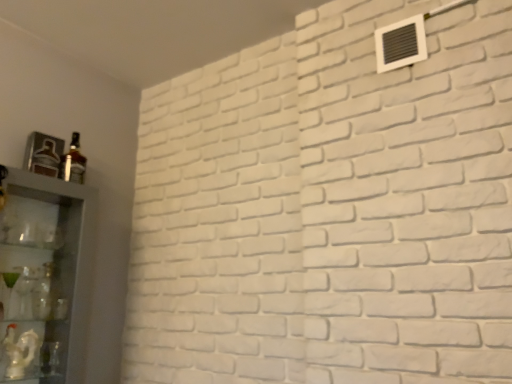
Question: Does matte glass bottle at left have a smaller size compared to white plastic air conditioning unit at upper right?

Choices:
 (A) no
 (B) yes

Answer: (B)

Question: Does matte glass bottle at left have a lesser height compared to white plastic air conditioning unit at upper right?

Choices:
 (A) yes
 (B) no

Answer: (B)

Question: Does matte glass bottle at left appear on the left side of white plastic air conditioning unit at upper right?

Choices:
 (A) no
 (B) yes

Answer: (B)

Question: Is matte glass bottle at left positioned with its back to white plastic air conditioning unit at upper right?

Choices:
 (A) no
 (B) yes

Answer: (A)

Question: From the image's perspective, would you say matte glass bottle at left is positioned over white plastic air conditioning unit at upper right?

Choices:
 (A) yes
 (B) no

Answer: (B)

Question: Is point (54, 379) closer or farther from the camera than point (86, 284)?

Choices:
 (A) farther
 (B) closer

Answer: (B)

Question: Considering their positions, is white glossy statue at lower left, which ranks as the 2th shelf in top-to-bottom order, located in front of or behind clear glass cabinet at left, positioned as the 1th shelf in top-to-bottom order?

Choices:
 (A) behind
 (B) front

Answer: (A)

Question: Is white glossy statue at lower left, which ranks as the 2th shelf in top-to-bottom order, taller or shorter than clear glass cabinet at left, marked as the 2th shelf in a bottom-to-top arrangement?

Choices:
 (A) tall
 (B) short

Answer: (B)

Question: Is white glossy statue at lower left, marked as the first shelf in a bottom-to-top arrangement, spatially inside clear glass cabinet at left, positioned as the 1th shelf in top-to-bottom order, or outside of it?

Choices:
 (A) outside
 (B) inside

Answer: (B)

Question: Is point (412, 23) positioned closer to the camera than point (31, 369)?

Choices:
 (A) farther
 (B) closer

Answer: (B)

Question: Is white plastic air conditioning unit at upper right inside or outside of white glossy statue at lower left, marked as the first shelf in a bottom-to-top arrangement?

Choices:
 (A) outside
 (B) inside

Answer: (A)

Question: From the image's perspective, is white plastic air conditioning unit at upper right above or below white glossy statue at lower left, which ranks as the 2th shelf in top-to-bottom order?

Choices:
 (A) below
 (B) above

Answer: (B)

Question: From a real-world perspective, is white plastic air conditioning unit at upper right physically located above or below white glossy statue at lower left, which ranks as the 2th shelf in top-to-bottom order?

Choices:
 (A) above
 (B) below

Answer: (A)

Question: From their relative heights in the image, would you say matte glass bottle at left is taller or shorter than white plastic air conditioning unit at upper right?

Choices:
 (A) tall
 (B) short

Answer: (A)

Question: In terms of width, does matte glass bottle at left look wider or thinner when compared to white plastic air conditioning unit at upper right?

Choices:
 (A) thin
 (B) wide

Answer: (B)